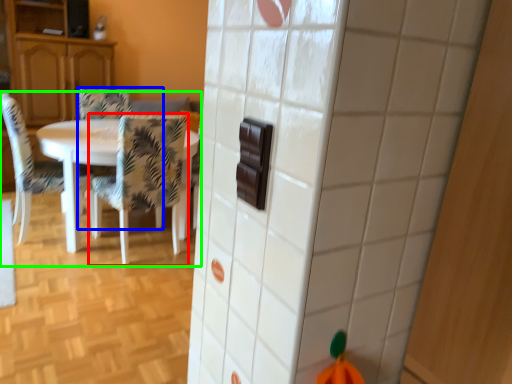
Question: Which object is positioned farthest from chair (highlighted by a red box)? Select from chair (highlighted by a blue box) and kitchen & dining room table (highlighted by a green box).

Choices:
 (A) chair
 (B) kitchen & dining room table

Answer: (A)